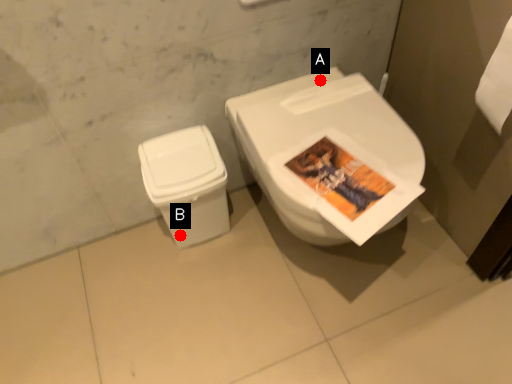
Question: Two points are circled on the image, labeled by A and B beside each circle. Which point is farther to the camera?

Choices:
 (A) A is further
 (B) B is further

Answer: (B)